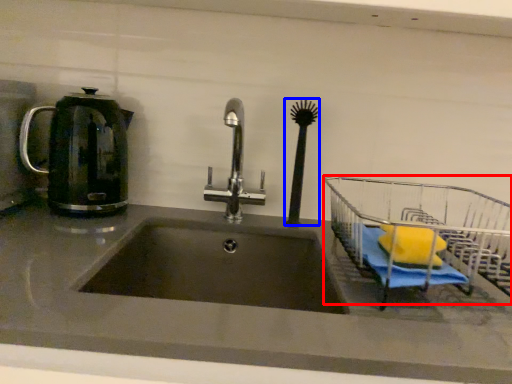
Question: Which point is further to the camera, cart (highlighted by a red box) or brush (highlighted by a blue box)?

Choices:
 (A) cart
 (B) brush

Answer: (B)